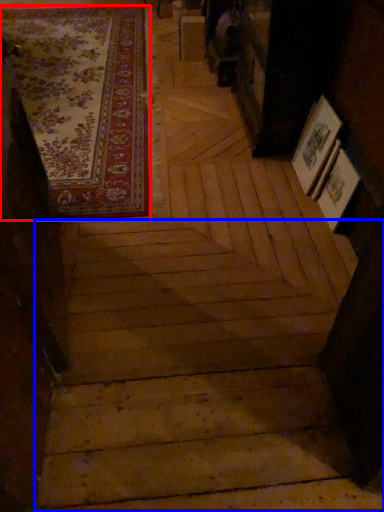
Question: Which object is further to the camera taking this photo, mat (highlighted by a red box) or stairwell (highlighted by a blue box)?

Choices:
 (A) mat
 (B) stairwell

Answer: (A)